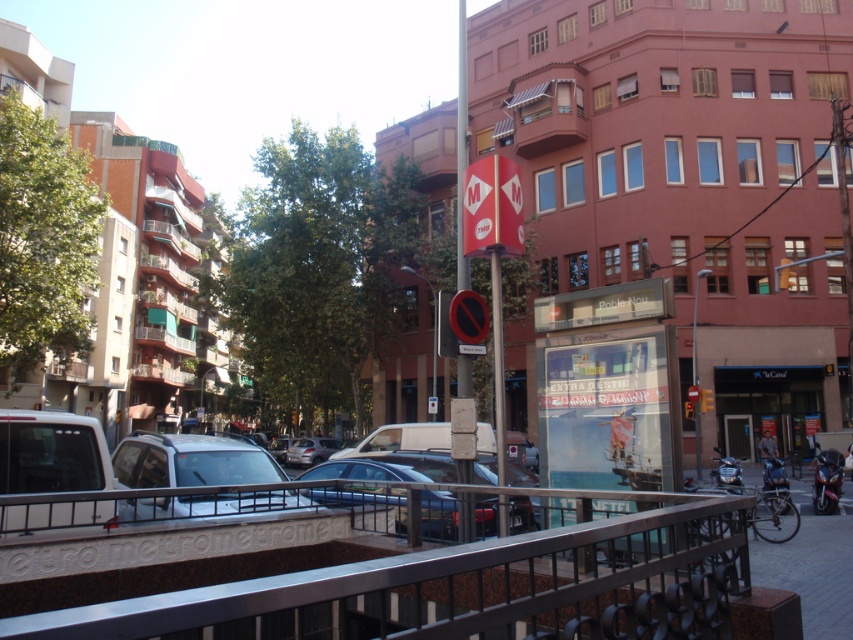
Which is more to the right, polished metal rail at center or red glass traffic light at upper right?

red glass traffic light at upper right

Is polished metal rail at center thinner than red glass traffic light at upper right?

Yes, polished metal rail at center is thinner than red glass traffic light at upper right.

Who is more forward, [416,579] or [781,275]?

Point [416,579] is in front.

Locate an element on the screen. This screenshot has height=640, width=853. polished metal rail at center is located at coordinates (473, 586).